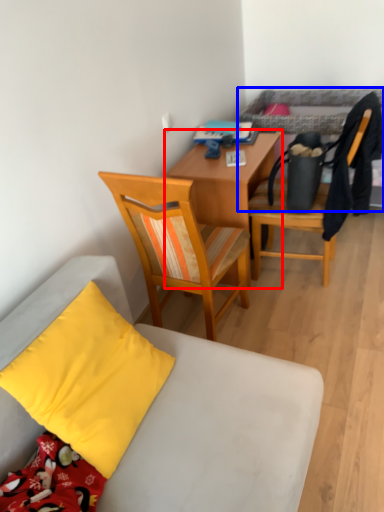
Question: Which object appears closest to the camera in this image, desk (highlighted by a red box) or bed (highlighted by a blue box)?

Choices:
 (A) desk
 (B) bed

Answer: (B)